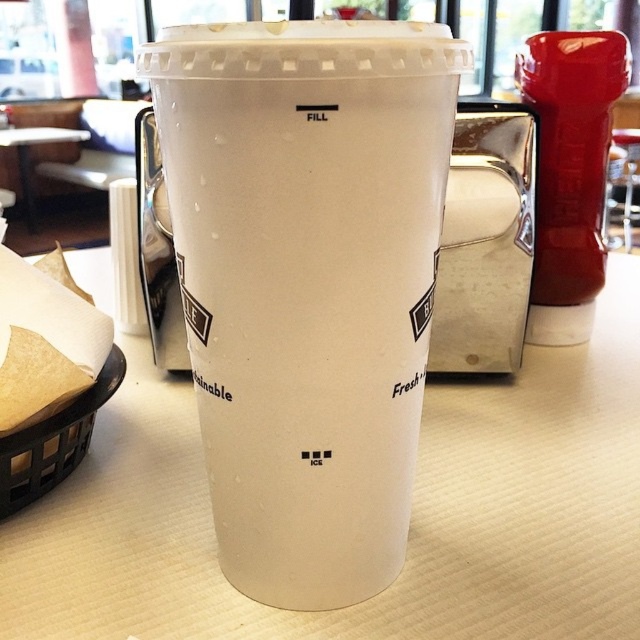
Can you confirm if white translucent cup at center is shorter than white paper towel at left?

In fact, white translucent cup at center may be taller than white paper towel at left.

Who is positioned more to the left, white translucent cup at center or white paper towel at left?

white paper towel at left

Describe the element at coordinates (307, 282) in the screenshot. This screenshot has height=640, width=640. I see `white translucent cup at center` at that location.

At what (x,y) coordinates should I click in order to perform the action: click on white translucent cup at center. Please return your answer as a coordinate pair (x, y). This screenshot has height=640, width=640. Looking at the image, I should click on (307, 282).

Does white translucent cup at center appear over white plastic cup at center?

Correct, white translucent cup at center is located above white plastic cup at center.

Does point (236, 387) come closer to viewer compared to point (522, 620)?

Yes, point (236, 387) is in front of point (522, 620).

The image size is (640, 640). What are the coordinates of `white translucent cup at center` in the screenshot? It's located at (307, 282).

Find the location of a particular element. This screenshot has width=640, height=640. white translucent cup at center is located at coordinates (307, 282).

Does white translucent cup at center have a greater height compared to black woven basket at lower left?

Yes, white translucent cup at center is taller than black woven basket at lower left.

Does white translucent cup at center come in front of black woven basket at lower left?

Yes, white translucent cup at center is in front of black woven basket at lower left.

Does point (264, 552) come farther from viewer compared to point (42, 444)?

No, it is in front of (42, 444).

This screenshot has height=640, width=640. Find the location of `white translucent cup at center`. white translucent cup at center is located at coordinates (307, 282).